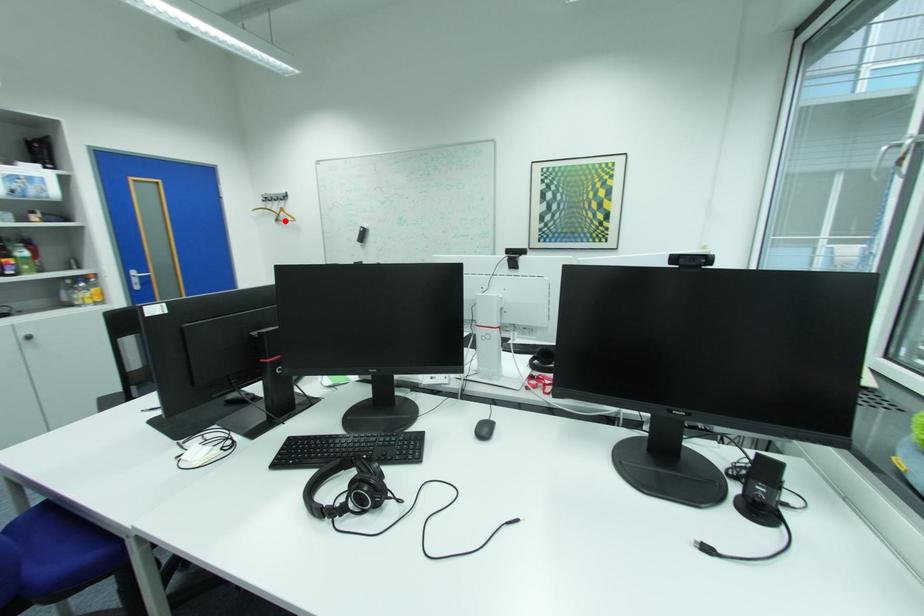
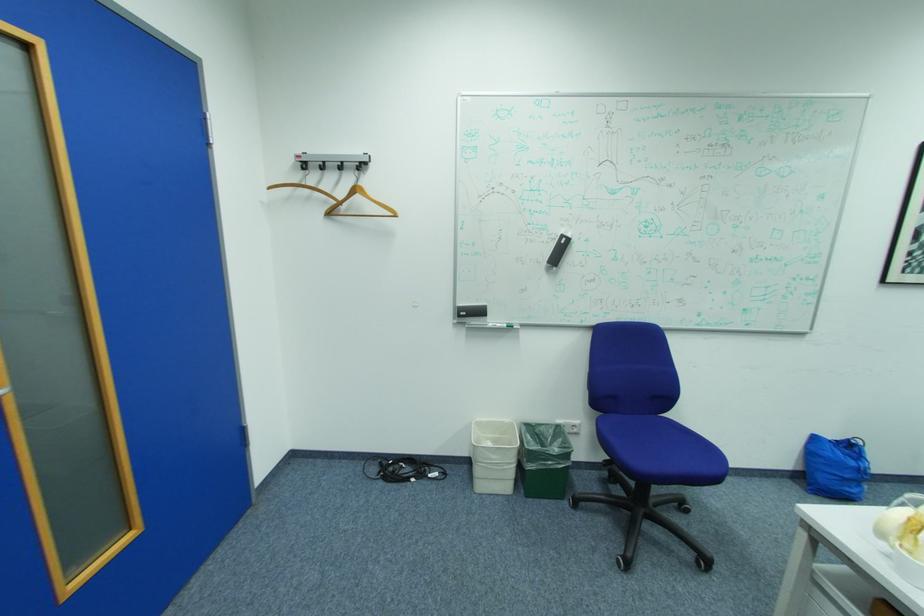
The point at the highlighted location is marked in the first image. Where is the corresponding point in the second image?

(337, 214)